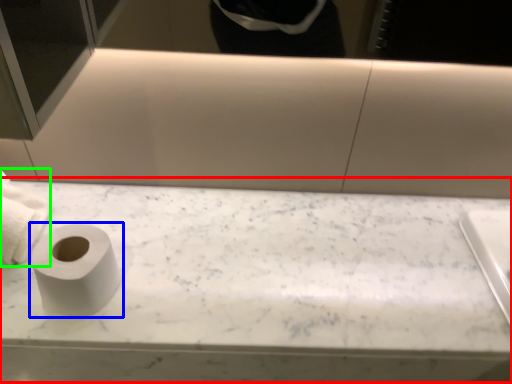
Question: Considering the real-world distances, which object is farthest from counter top (highlighted by a red box)? toilet paper (highlighted by a blue box) or toilet paper (highlighted by a green box)?

Choices:
 (A) toilet paper
 (B) toilet paper

Answer: (B)